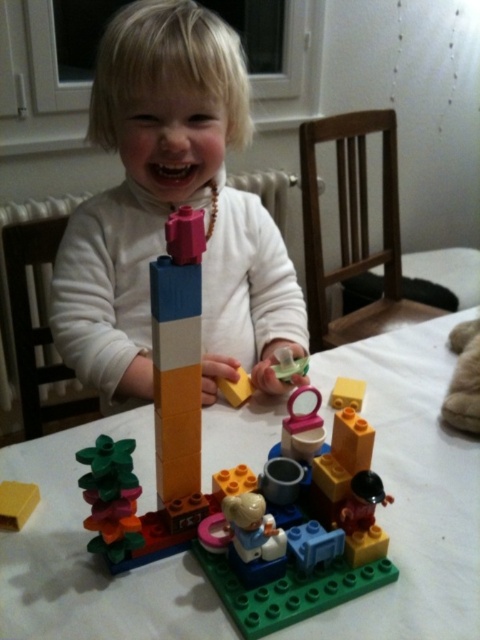
Question: Which is nearer to the white plastic table at center?

Choices:
 (A) white matte toddler at center
 (B) matte orange block at center
 (C) yellow matte block at center
 (D) smooth plastic lego set at center

Answer: (D)

Question: Which point is closer to the camera?

Choices:
 (A) (214, 278)
 (B) (359, 406)

Answer: (B)

Question: Is white plastic table at center smaller than white matte toddler at center?

Choices:
 (A) yes
 (B) no

Answer: (B)

Question: Does white matte toddler at center appear on the right side of matte orange block at center?

Choices:
 (A) yes
 (B) no

Answer: (A)

Question: Can you confirm if matte orange block at center is positioned to the left of yellow matte block at center?

Choices:
 (A) no
 (B) yes

Answer: (B)

Question: Estimate the real-world distances between objects in this image. Which object is farther from the yellow matte block at center?

Choices:
 (A) smooth plastic lego set at center
 (B) white plastic table at center

Answer: (A)